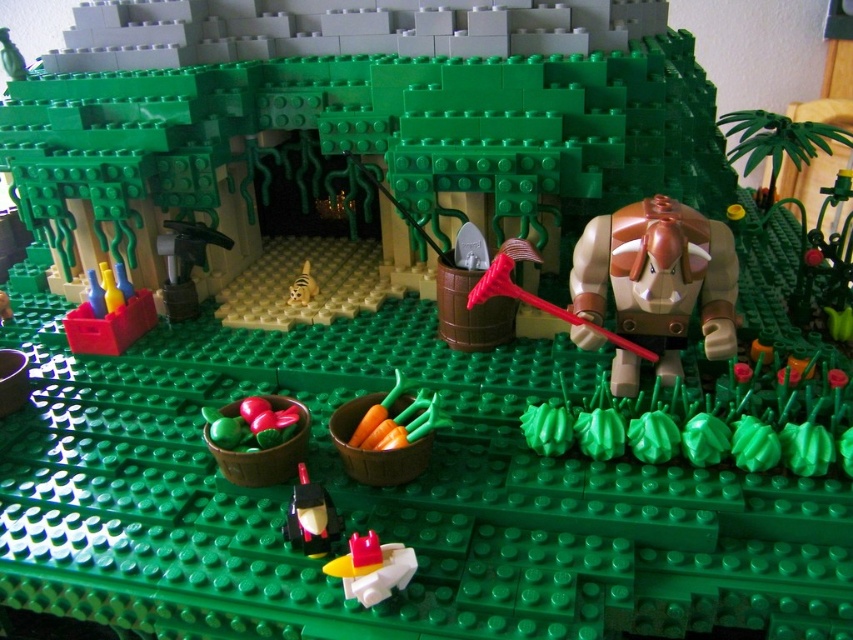
Question: Which of these objects is positioned farthest from the tan/leather-like figure at center-right?

Choices:
 (A) translucent yellow plastic spaceship at center
 (B) yellow plastic tiger at center
 (C) metallic gray hammer at center-left

Answer: (C)

Question: Does translucent yellow plastic spaceship at center have a greater width compared to yellow plastic tiger at center?

Choices:
 (A) no
 (B) yes

Answer: (B)

Question: Is smooth plastic vegetables at lower center closer to the viewer compared to shiny red car at lower center?

Choices:
 (A) no
 (B) yes

Answer: (A)

Question: Estimate the real-world distances between objects in this image. Which object is closer to the translucent yellow plastic spaceship at center?

Choices:
 (A) shiny red car at lower center
 (B) tan/leather-like figure at center-right

Answer: (A)

Question: Is translucent yellow plastic spaceship at center wider than smooth plastic vegetables at lower center?

Choices:
 (A) yes
 (B) no

Answer: (B)

Question: Among these objects, which one is farthest from the camera?

Choices:
 (A) yellow plastic tiger at center
 (B) translucent yellow plastic spaceship at center
 (C) tan/leather-like figure at center-right

Answer: (A)